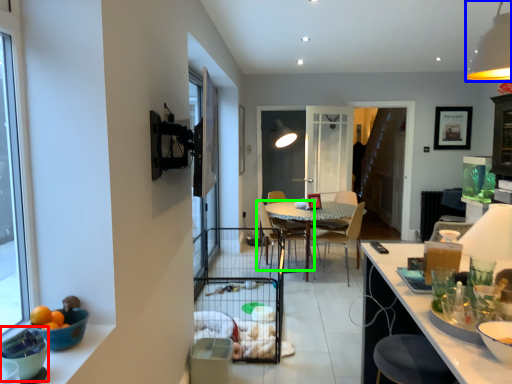
Question: Based on their relative distances, which object is farther from bowl (highlighted by a red box)? Choose from light fixture (highlighted by a blue box) and chair (highlighted by a green box).

Choices:
 (A) light fixture
 (B) chair

Answer: (B)